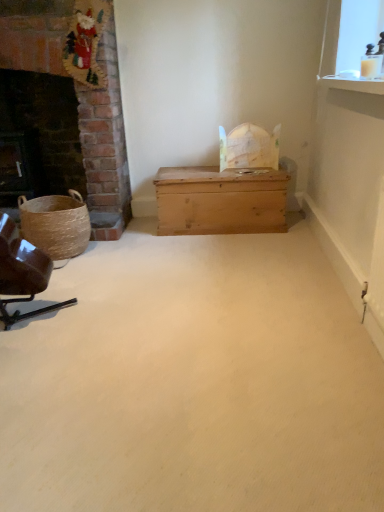
Question: Does point (203, 204) appear closer or farther from the camera than point (370, 467)?

Choices:
 (A) closer
 (B) farther

Answer: (B)

Question: Which is correct: light brown wooden chest at center is inside wooden trunk at center, or outside of it?

Choices:
 (A) outside
 (B) inside

Answer: (A)

Question: Estimate the real-world distances between objects in this image. Which object is farther from the brown leather chair at left?

Choices:
 (A) wooden trunk at center
 (B) woven brown basket at left
 (C) dark brick fireplace at left
 (D) light brown wooden chest at center

Answer: (C)

Question: Which is farther from the woven brown basket at left?

Choices:
 (A) light brown wooden chest at center
 (B) wooden trunk at center
 (C) dark brick fireplace at left
 (D) brown leather chair at left

Answer: (B)